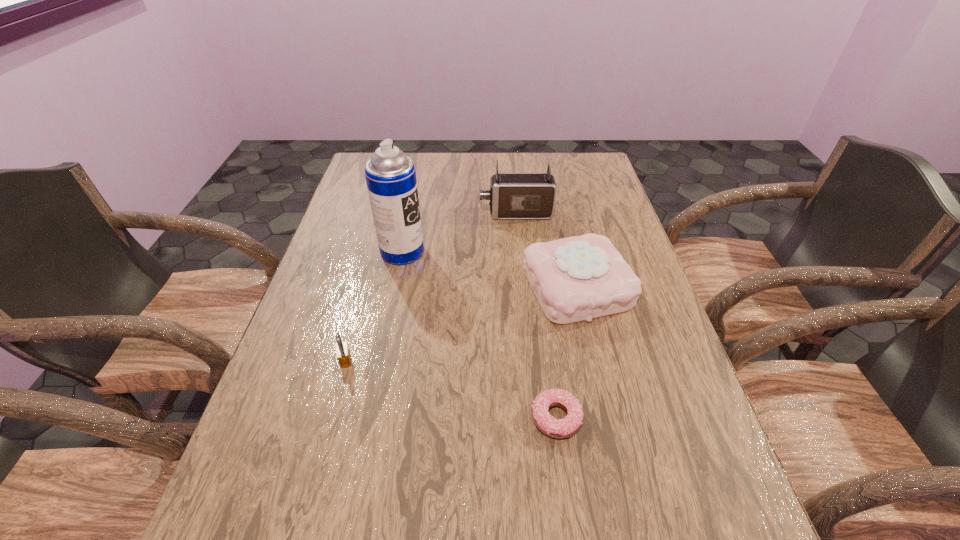
Select which object is the second closest to the second object from left to right. Please provide its 2D coordinates. Your answer should be formatted as a tuple, i.e. [(x, y)], where the tuple contains the x and y coordinates of a point satisfying the conditions above.

[(578, 278)]

Identify the location of free space that satisfies the following two spatial constraints: 1. on the label side of the cake; 2. on the left side of the tallest object. The image size is (960, 540). (396, 287).

You are a GUI agent. You are given a task and a screenshot of the screen. Output one action in this format:
    pyautogui.click(x=<x>, y=<y>)
    Task: Click on the vacant space that satisfies the following two spatial constraints: 1. at the lens of the shortest object; 2. on the right side of the fourth shortest object
    This screenshot has height=540, width=960.
    Given the screenshot: What is the action you would take?
    pyautogui.click(x=537, y=418)

Identify the location of blank space that satisfies the following two spatial constraints: 1. at the lens of the camcorder; 2. on the front side of the leftmost object. (531, 360).

Where is `vacant space that satisfies the following two spatial constraints: 1. on the back side of the cake; 2. on the label side of the tallest object`? vacant space that satisfies the following two spatial constraints: 1. on the back side of the cake; 2. on the label side of the tallest object is located at coordinates (568, 252).

This screenshot has height=540, width=960. Find the location of `vacant space that satisfies the following two spatial constraints: 1. at the lens of the farthest object; 2. on the back side of the shortest object`. vacant space that satisfies the following two spatial constraints: 1. at the lens of the farthest object; 2. on the back side of the shortest object is located at coordinates (537, 418).

Where is `blank space that satisfies the following two spatial constraints: 1. on the back side of the third tallest object; 2. on the label side of the second object from left to right`? blank space that satisfies the following two spatial constraints: 1. on the back side of the third tallest object; 2. on the label side of the second object from left to right is located at coordinates (568, 252).

At what (x,y) coordinates should I click in order to perform the action: click on vacant space that satisfies the following two spatial constraints: 1. at the lens of the doughnut; 2. on the left side of the camcorder. Please return your answer as a coordinate pair (x, y). Looking at the image, I should click on (537, 418).

Identify the location of free space that satisfies the following two spatial constraints: 1. on the label side of the third shortest object; 2. on the right side of the aerosol can. (396, 287).